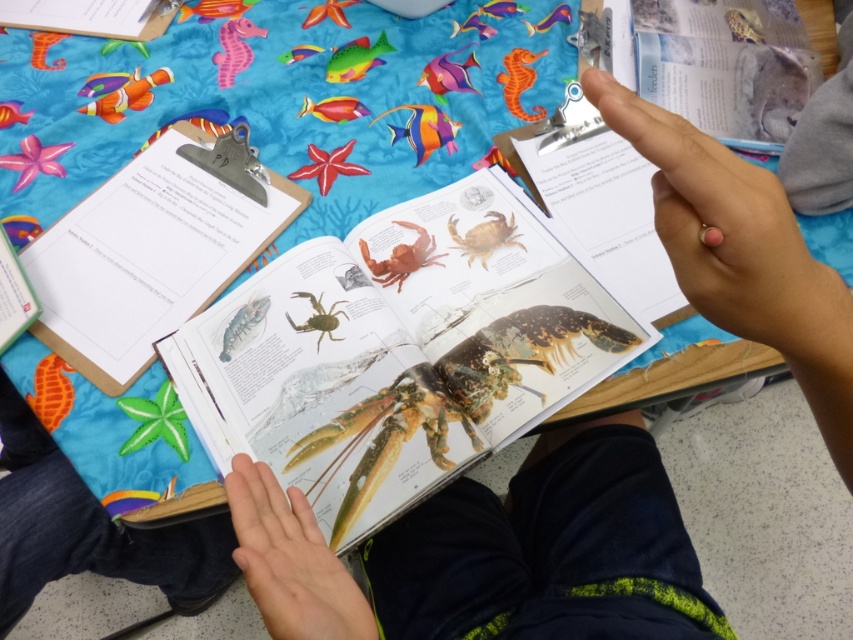
Question: Is smooth skin hand at upper right thinner than matte paper clipboard at upper left?

Choices:
 (A) yes
 (B) no

Answer: (B)

Question: Which object is positioned farthest from the smooth skin hand at upper right?

Choices:
 (A) shiny paper book at center
 (B) smooth brown crab at center
 (C) matte paper clipboard at upper left
 (D) matte brown crab at center

Answer: (C)

Question: Does smooth brown crab at center have a greater width compared to matte green crab at center?

Choices:
 (A) no
 (B) yes

Answer: (B)

Question: Is shiny paper book at center thinner than matte gray seashell at upper right?

Choices:
 (A) yes
 (B) no

Answer: (B)

Question: Which point is farther from the camera taking this photo?

Choices:
 (A) (479, 230)
 (B) (316, 323)
 (C) (405, 397)

Answer: (A)

Question: Which object appears farthest from the camera in this image?

Choices:
 (A) smooth skin hand at upper right
 (B) matte gray seashell at upper right

Answer: (B)